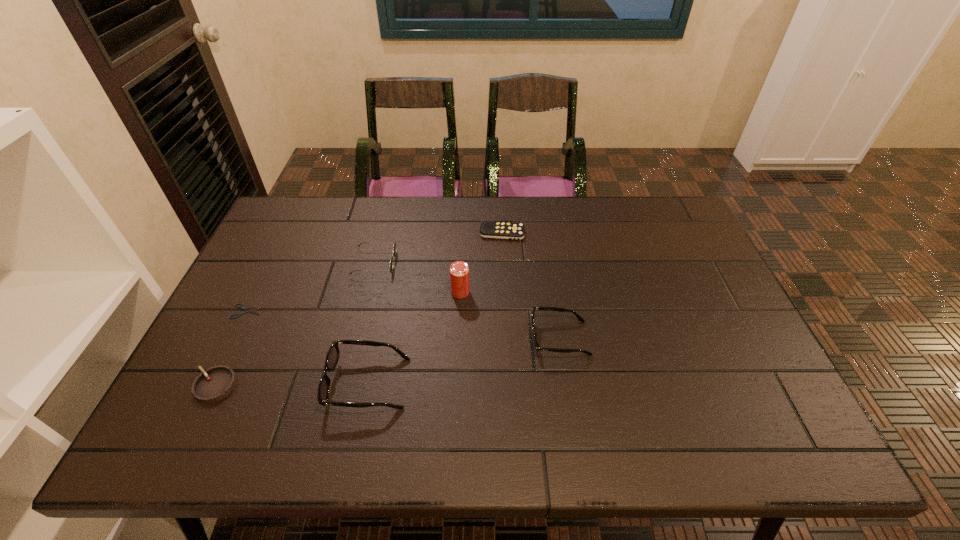
Identify the location of free spot at the near edge of the desktop. (498, 391).

Image resolution: width=960 pixels, height=540 pixels. Identify the location of vacant space at the left edge. (274, 302).

The height and width of the screenshot is (540, 960). In the image, there is a desktop. Identify the location of vacant space at the right edge. (708, 291).

Identify the location of blank area at the far left corner. (285, 211).

In the image, there is a desktop. At what (x,y) coordinates should I click in order to perform the action: click on vacant space at the far right corner. Please return your answer as a coordinate pair (x, y). Looking at the image, I should click on (688, 231).

This screenshot has width=960, height=540. Identify the location of empty space that is in between the ashtray and the shorter spectacles. (388, 362).

At what (x,y) coordinates should I click in order to perform the action: click on vacant region between the shorter spectacles and the sunglasses. Please return your answer as a coordinate pair (x, y). The width and height of the screenshot is (960, 540). Looking at the image, I should click on (x=467, y=301).

The width and height of the screenshot is (960, 540). In order to click on empty space that is in between the taller spectacles and the shears in this screenshot , I will do `click(307, 347)`.

This screenshot has width=960, height=540. I want to click on empty space that is in between the farthest object and the shears, so click(x=374, y=272).

In order to click on free space between the fifth nearest object and the third tallest object in this screenshot , I will do `click(510, 315)`.